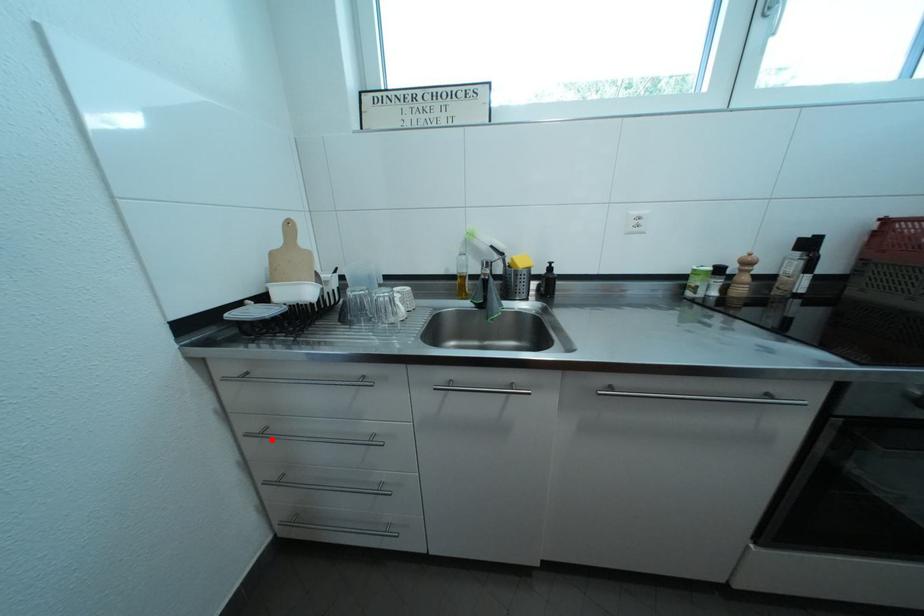
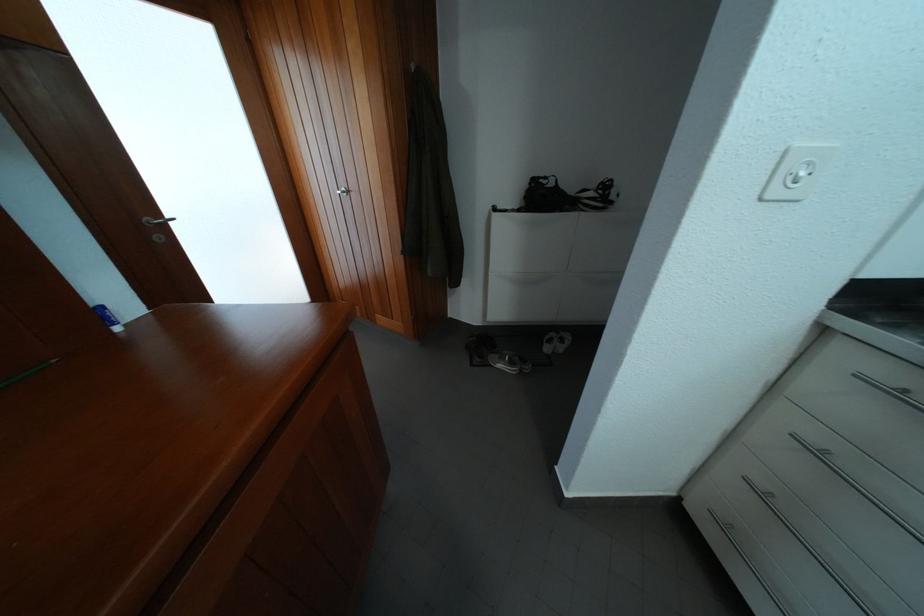
Locate, in the second image, the point that corresponds to the highlighted location in the first image.

(829, 460)